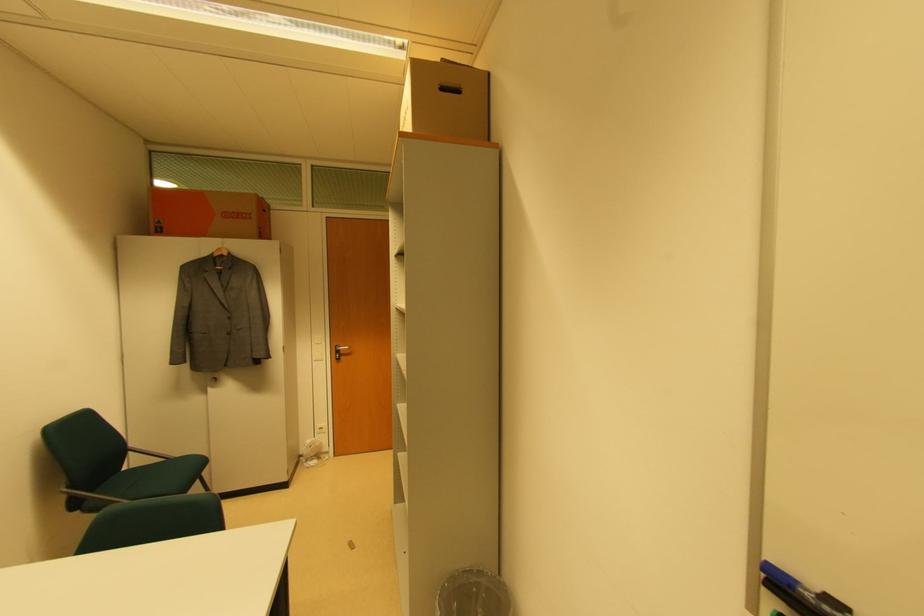
Identify the location of cardboard box handle. Image resolution: width=924 pixels, height=616 pixels. (450, 89).